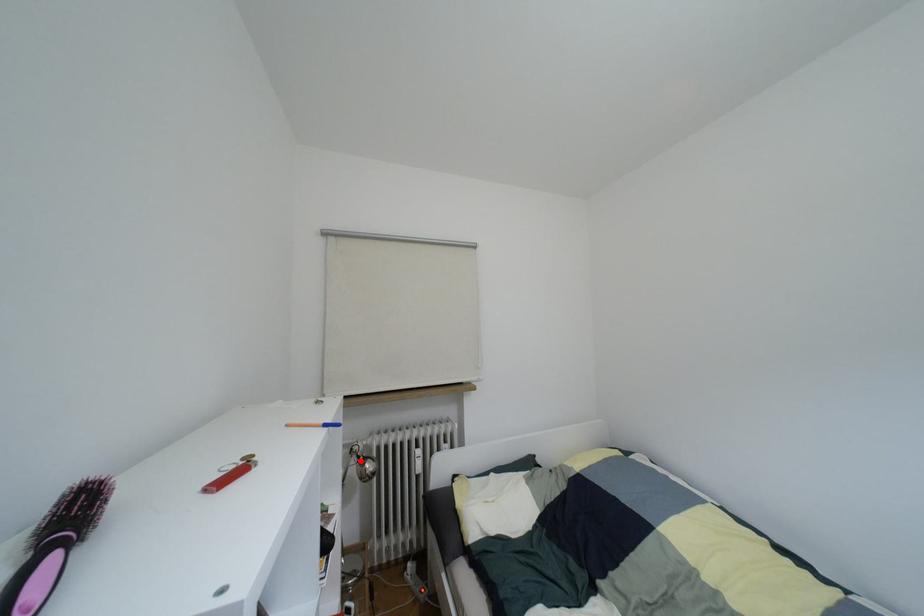
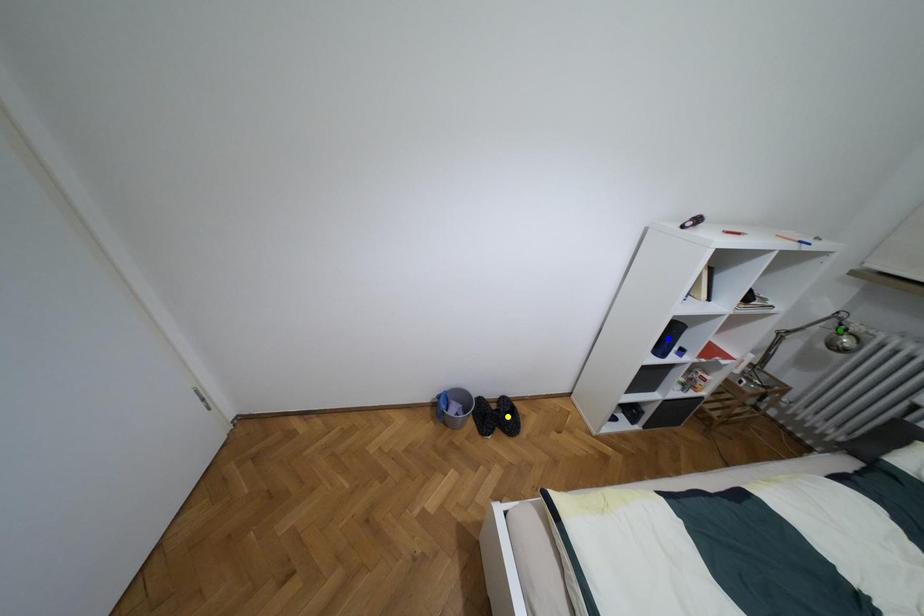
Question: I am providing you with two images of the same scene from different viewpoints. A red point is marked on the first image. You are given multiple points on the second image. Which point in image 2 represents the same 3d spot as the red point in image 1?

Choices:
 (A) blue point
 (B) green point
 (C) yellow point

Answer: (B)